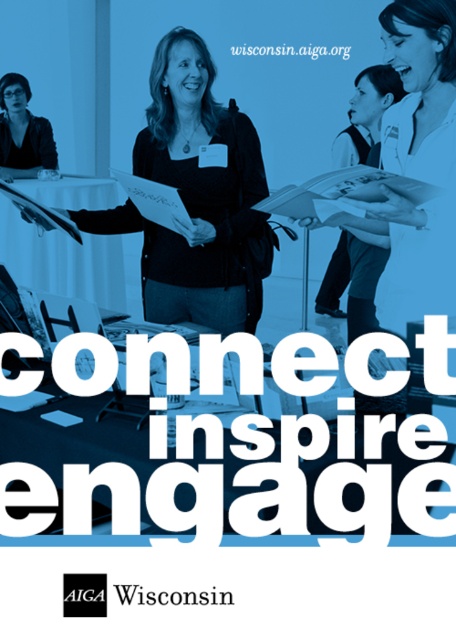
Between matte black jacket at upper left and white paper at upper center, which one has more height?

matte black jacket at upper left

Looking at this image, between matte black jacket at upper left and white paper at upper center, which one is positioned lower?

matte black jacket at upper left is lower down.

What do you see at coordinates (22, 132) in the screenshot? The height and width of the screenshot is (640, 456). I see `matte black jacket at upper left` at bounding box center [22, 132].

Locate an element on the screen. matte black jacket at upper left is located at coordinates (22, 132).

Who is positioned more to the left, matte black sweater at center or blacktexturedwisconsin at center?

Positioned to the left is matte black sweater at center.

Is matte black sweater at center smaller than blacktexturedwisconsin at center?

Incorrect, matte black sweater at center is not smaller in size than blacktexturedwisconsin at center.

Which is in front, point (269, 253) or point (136, 588)?

Point (136, 588) is more forward.

You are a GUI agent. You are given a task and a screenshot of the screen. Output one action in this format:
    pyautogui.click(x=<x>, y=<y>)
    Task: Click on the matte black sweater at center
    
    Given the screenshot: What is the action you would take?
    pyautogui.click(x=196, y=198)

How far apart are matte black jacket at upper left and blacktexturedwisconsin at center?

matte black jacket at upper left is 4.38 meters from blacktexturedwisconsin at center.

Does matte black jacket at upper left appear over blacktexturedwisconsin at center?

Indeed, matte black jacket at upper left is positioned over blacktexturedwisconsin at center.

Describe the element at coordinates (22, 132) in the screenshot. This screenshot has width=456, height=640. I see `matte black jacket at upper left` at that location.

Identify the location of matte black jacket at upper left. (22, 132).